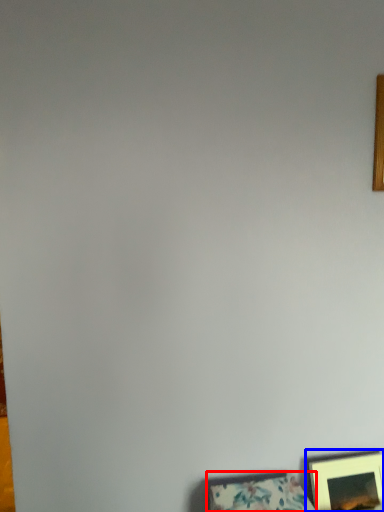
Question: Among these objects, which one is nearest to the camera, picture frame (highlighted by a red box) or picture frame (highlighted by a blue box)?

Choices:
 (A) picture frame
 (B) picture frame

Answer: (A)